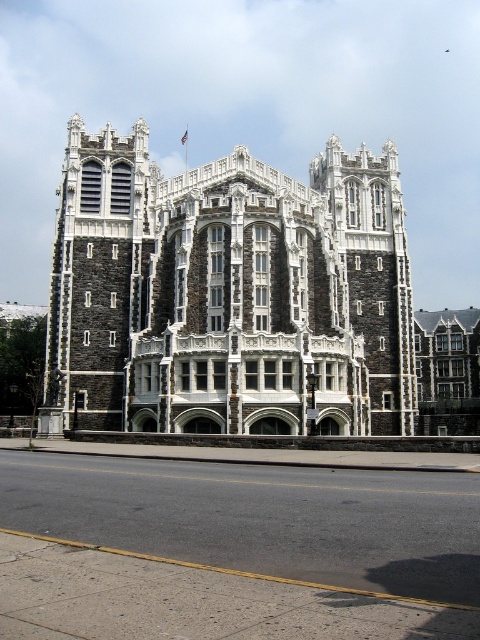
Find the location of a particular element. Image resolution: width=480 pixels, height=640 pixels. stone/brick church at center is located at coordinates (229, 292).

Which is above, stone/brick church at center or dark gray stone tower at left?

dark gray stone tower at left

The image size is (480, 640). What do you see at coordinates (229, 292) in the screenshot?
I see `stone/brick church at center` at bounding box center [229, 292].

I want to click on stone/brick church at center, so click(x=229, y=292).